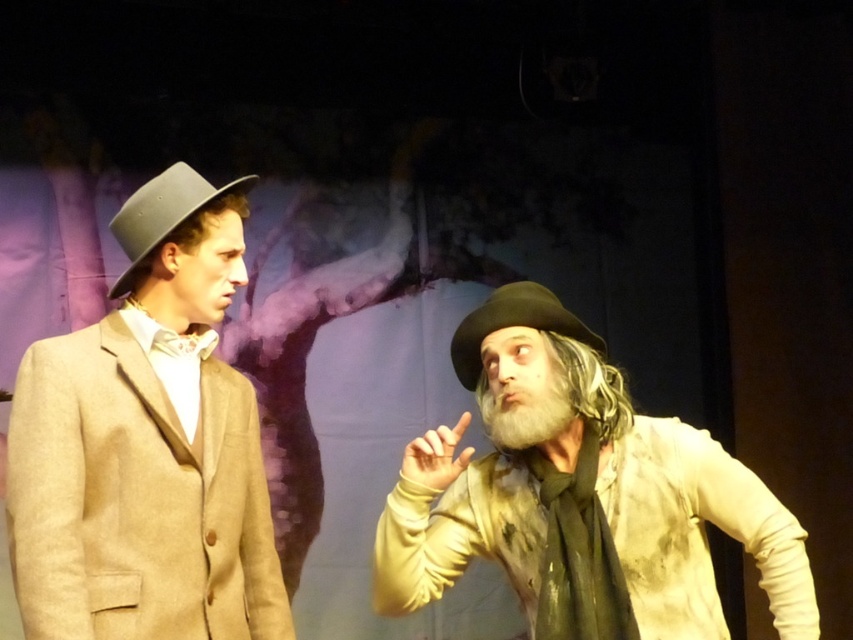
Which of these two, dirty beige shirt at right or white fuzzy beard at right, stands shorter?

white fuzzy beard at right is shorter.

Measure the distance from dirty beige shirt at right to white fuzzy beard at right.

dirty beige shirt at right is 14.12 centimeters away from white fuzzy beard at right.

Is point (520, 454) positioned after point (491, 432)?

Yes, point (520, 454) is farther from viewer.

I want to click on dirty beige shirt at right, so click(585, 486).

Is dirty beige shirt at right smaller than black felt dress hat at center?

No.

From the picture: Is dirty beige shirt at right to the left of black felt dress hat at center from the viewer's perspective?

No, dirty beige shirt at right is not to the left of black felt dress hat at center.

Looking at this image, who is more distant from viewer, (598, 419) or (471, 390)?

The point (471, 390) is more distant.

Locate an element on the screen. The image size is (853, 640). dirty beige shirt at right is located at coordinates (585, 486).

Between point (202, 218) and point (479, 308), which one is positioned behind?

The point (479, 308) is more distant.

The image size is (853, 640). Describe the element at coordinates (148, 445) in the screenshot. I see `matte brown suit at left` at that location.

Does point (45, 461) come behind point (602, 496)?

No, (45, 461) is closer to viewer.

I want to click on matte brown suit at left, so click(148, 445).